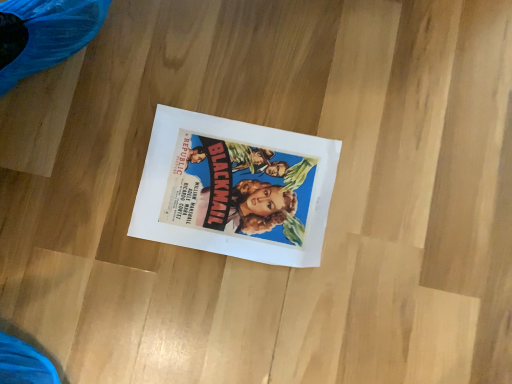
What do you see at coordinates (234, 188) in the screenshot?
I see `white paper at center` at bounding box center [234, 188].

Measure the distance between white paper at center and camera.

The depth of white paper at center is 25.16 inches.

At what (x,y) coordinates should I click in order to perform the action: click on white paper at center. Please return your answer as a coordinate pair (x, y). Looking at the image, I should click on (234, 188).

Identify the location of white paper at center. (234, 188).